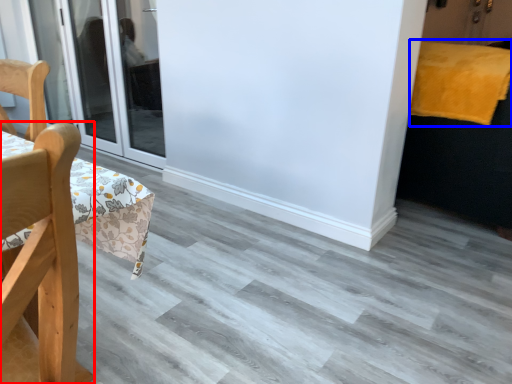
Question: Which of the following is the closest to the observer, chair (highlighted by a red box) or blanket (highlighted by a blue box)?

Choices:
 (A) chair
 (B) blanket

Answer: (A)